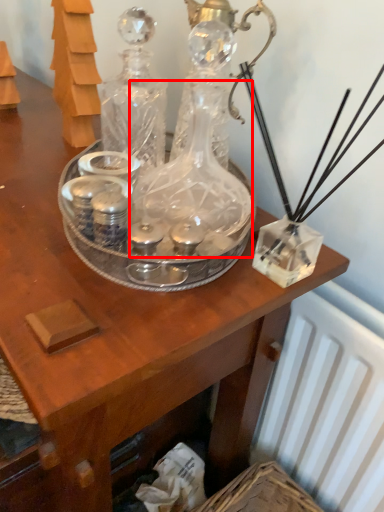
Question: From the image's perspective, what is the correct spatial positioning of glass bottle (annotated by the red box) in reference to glass bottle?

Choices:
 (A) above
 (B) below

Answer: (B)